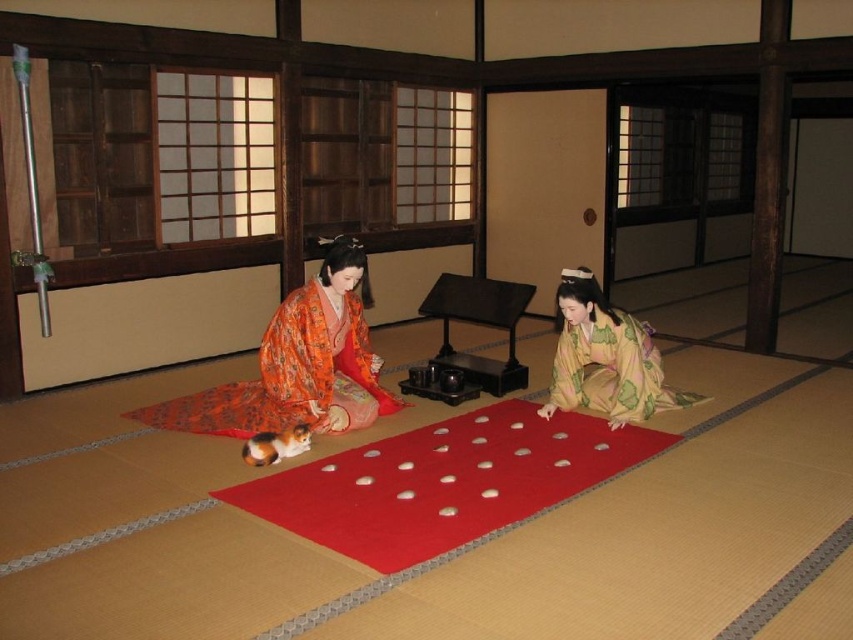
You are standing in the traditional Japanese room and see two points marked on the floor. The first point is at coordinates point (351, 401) and the second is at point (701, 396). If you are facing the sliding doors, which point is closer to you?

Point (351, 401) is in front of point (701, 396), so if you are facing the sliding doors, the point closer to you would be point (351, 401).

You are standing in the room and want to place a 10 feet long scroll on the red felt mat at center. Can you fit it diagonally on the mat?

The red felt mat at center is 8.65 feet from camera, but the distance from the camera does not indicate the mat size. Therefore, it is unclear if the 10 feet long scroll can fit diagonally on the mat.